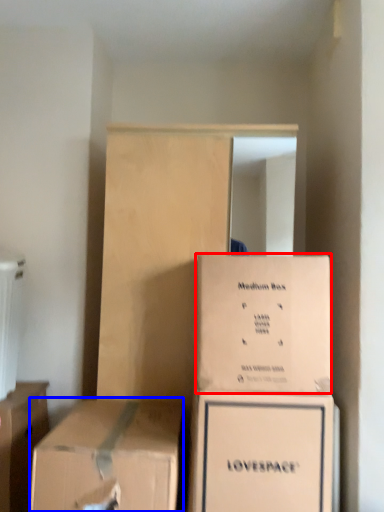
Question: Which of the following is the farthest to the observer, box (highlighted by a red box) or box (highlighted by a blue box)?

Choices:
 (A) box
 (B) box

Answer: (A)